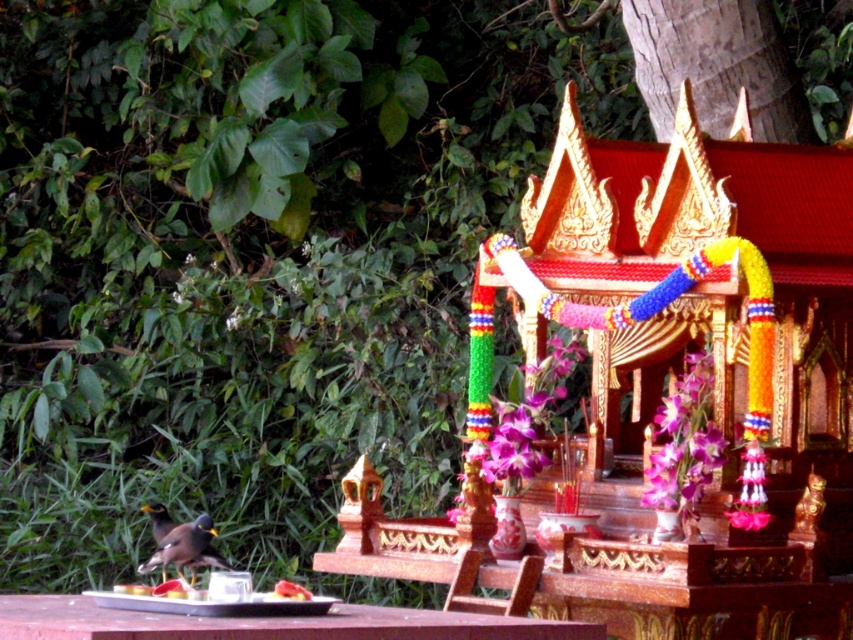
You are a photographer standing 3 meters away from the shrine. You want to take a picture of the shiny brown bird at lower left and the smooth red plate at lower center in the same frame. Can you position yourself so that both objects are visible without moving the camera? Explain why or why not.

The shiny brown bird at lower left is 2.53 meters from the smooth red plate at lower center. Since the photographer is already 3 meters away from the shrine, the distance between the two objects is less than the photographer distance, so both objects can be captured in the same frame without moving the camera.

Looking at this image, you are standing in front of the shrine and want to place a new offering on the wooden table at center. However, there is a shiny brown bird at lower left nearby. Based on their positions, can you determine if the bird is behind or in front of the table?

The wooden table at center is in front of the shiny brown bird at lower left, so the bird is behind the table.